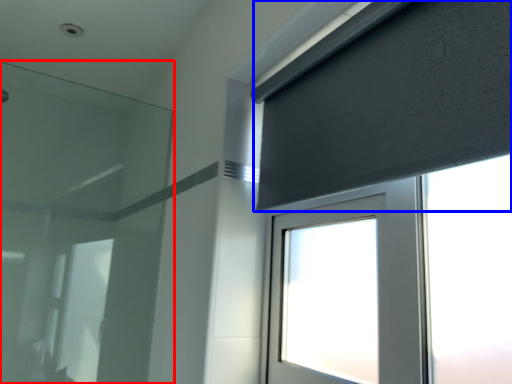
Question: Which point is further to the camera, filter (highlighted by a red box) or curtain (highlighted by a blue box)?

Choices:
 (A) filter
 (B) curtain

Answer: (A)